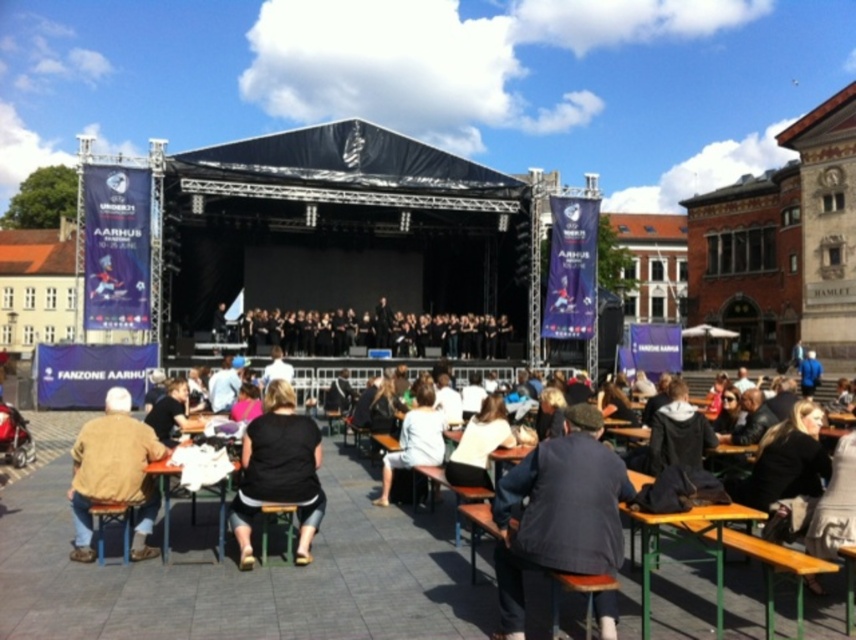
You are a photographer at the event and want to capture both the black fabric shirt at center and the light beige cotton shirt at center in a single frame. Which shirt should you adjust your camera angle to include more of, considering their sizes?

The black fabric shirt at center has a larger width than the light beige cotton shirt at center. To include both in the frame, you should adjust your camera angle to accommodate the wider black fabric shirt at center.

You are an event organizer checking the stage setup. You need to place a microphone stand exactly at coordinate point 0.738, 0.326. Is the black fabric shirt at center currently occupying that location?

The black fabric shirt at center is located at point (278, 472), so yes, it is occupying that location. You will need to move it before placing the microphone stand there.

Based on the photo, you are an event organizer looking at the stage setup. You notice two performers wearing a black fabric shirt at center and a light beige cotton shirt at center. Which performer is standing to the left of the other?

The black fabric shirt at center is positioned on the left side of light beige cotton shirt at center, so the performer in the black fabric shirt is to the left of the one in the light beige cotton shirt.